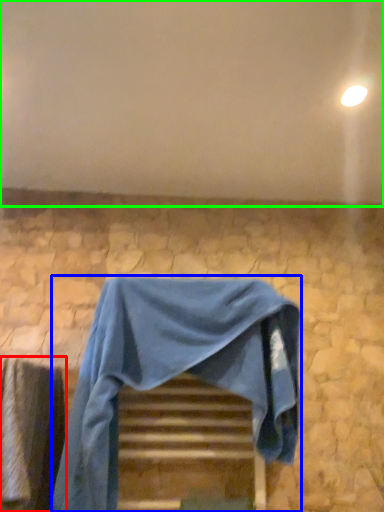
Question: Based on their relative distances, which object is nearer to curtain (highlighted by a red box)? Choose from furniture (highlighted by a blue box) and backdrop (highlighted by a green box).

Choices:
 (A) furniture
 (B) backdrop

Answer: (A)